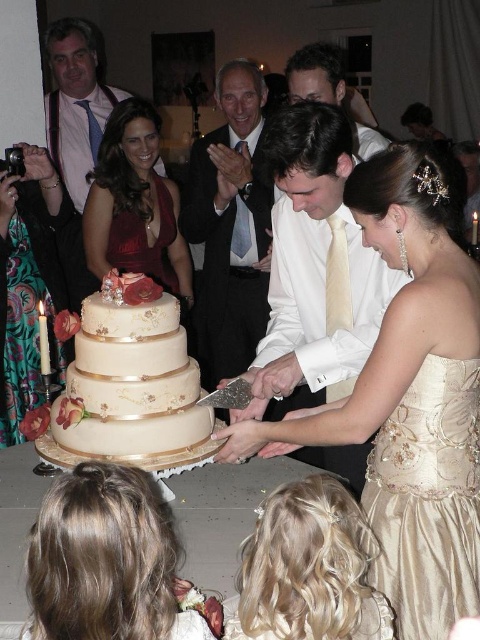
Question: Can you confirm if gold satin dress at center is thinner than gold satin wedding dress at lower right?

Choices:
 (A) no
 (B) yes

Answer: (A)

Question: Does white satin shirt at center appear under velvet burgundy dress at center?

Choices:
 (A) no
 (B) yes

Answer: (B)

Question: Based on their relative distances, which object is farther from the white satin shirt at center?

Choices:
 (A) blonde hair at lower left
 (B) gold satin dress at center
 (C) blonde hair at lower center

Answer: (A)

Question: Does white satin shirt at center appear under blonde hair at lower left?

Choices:
 (A) yes
 (B) no

Answer: (B)

Question: Estimate the real-world distances between objects in this image. Which object is farther from the blonde hair at lower center?

Choices:
 (A) matte cream cake at center
 (B) blonde hair at lower left

Answer: (A)

Question: Which point appears closest to the camera in this image?

Choices:
 (A) (292, 300)
 (B) (159, 600)
 (C) (244, 580)
 (D) (208, 426)

Answer: (B)